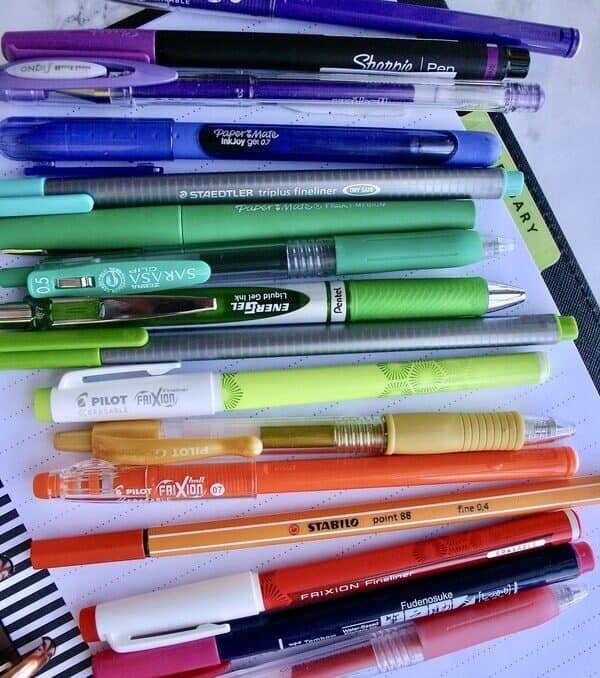
Where is `pens with a green hue`? The height and width of the screenshot is (678, 600). pens with a green hue is located at coordinates (360, 214), (353, 247), (369, 287), (379, 327), (382, 378).